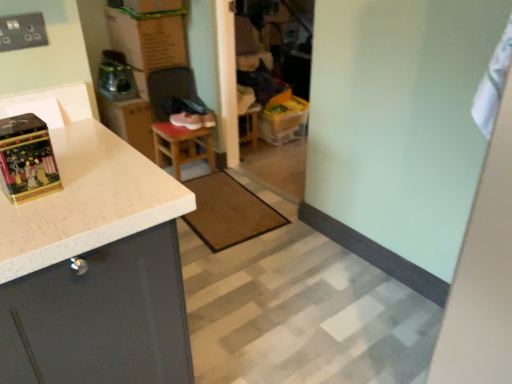
Where is `free space above white speckled laminate cabinet at left (from a real-world perspective)`? This screenshot has width=512, height=384. free space above white speckled laminate cabinet at left (from a real-world perspective) is located at coordinates (79, 175).